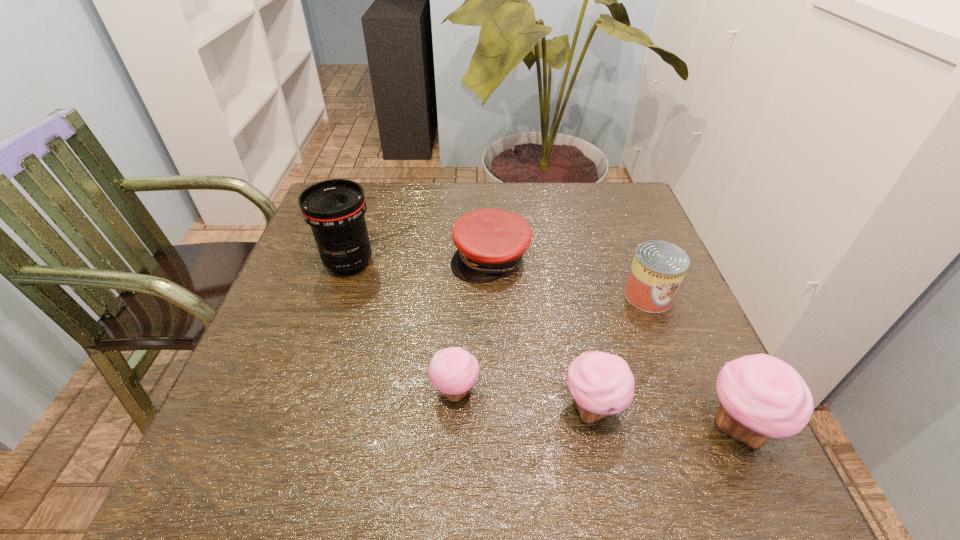
Locate an element on the screen. vacant space that satisfies the following two spatial constraints: 1. on the front-facing side of the cap; 2. on the right side of the rightmost cupcake is located at coordinates (494, 427).